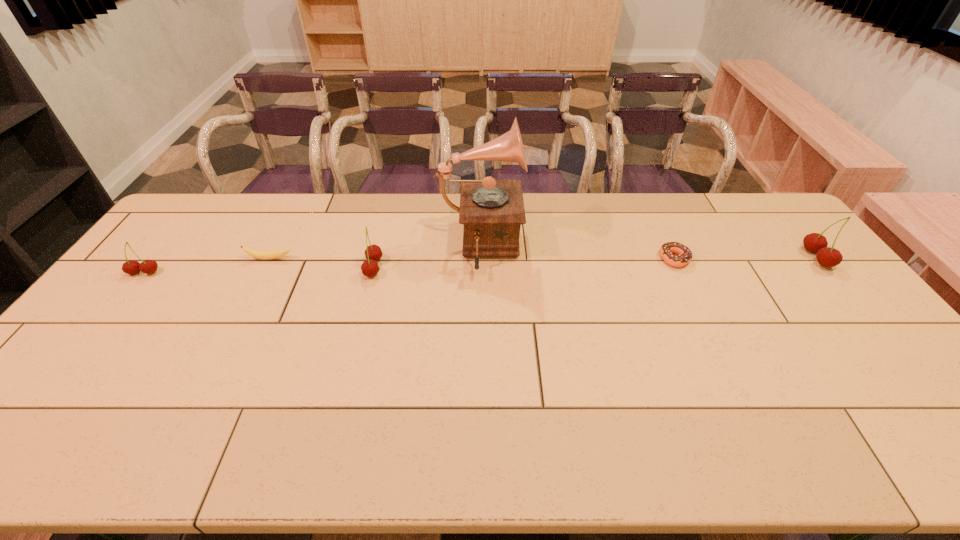
Where is `free spot between the tallest object and the rightmost object`? The height and width of the screenshot is (540, 960). free spot between the tallest object and the rightmost object is located at coordinates (648, 253).

Where is `empty space between the fourth tallest object and the third object from right to left`? The height and width of the screenshot is (540, 960). empty space between the fourth tallest object and the third object from right to left is located at coordinates (x=312, y=261).

Find the location of a particular element. Image resolution: width=960 pixels, height=540 pixels. free point between the rightmost cherry and the fifth object from right to left is located at coordinates (543, 258).

The height and width of the screenshot is (540, 960). Identify the location of vacant point located between the second cherry from right to left and the third object from right to left. (427, 258).

You are a GUI agent. You are given a task and a screenshot of the screen. Output one action in this format:
    pyautogui.click(x=<x>, y=<y>)
    Task: Click on the free space between the banana and the rightmost cherry
    
    Given the screenshot: What is the action you would take?
    coord(543,258)

What are the coordinates of `the closest object relative to the record player` in the screenshot? It's located at (373, 253).

What are the coordinates of `object that can be found as the fifth closest to the second shortest object` in the screenshot? It's located at (828, 257).

Where is `cherry that is the second closest one to the third tallest object`? Image resolution: width=960 pixels, height=540 pixels. cherry that is the second closest one to the third tallest object is located at coordinates (828, 257).

In order to click on cherry that is the third closest one to the shortest object in this screenshot , I will do `click(131, 267)`.

Image resolution: width=960 pixels, height=540 pixels. I want to click on vacant region that satisfies the following two spatial constraints: 1. on the front side of the second object from right to left; 2. on the surface of the second shortest cherry, so click(679, 268).